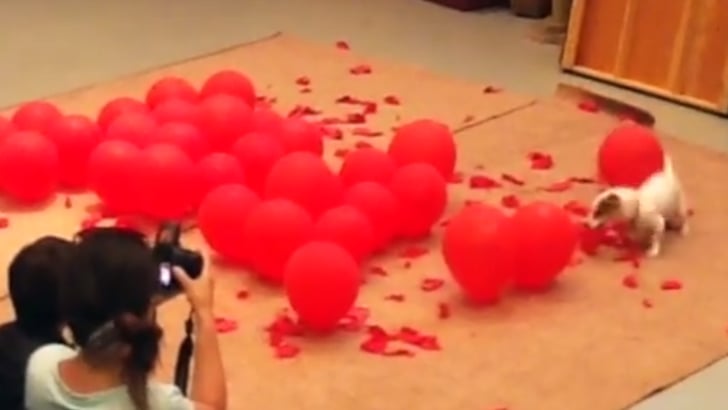
Find the location of a particular element. This screenshot has height=410, width=728. screen is located at coordinates (164, 275).